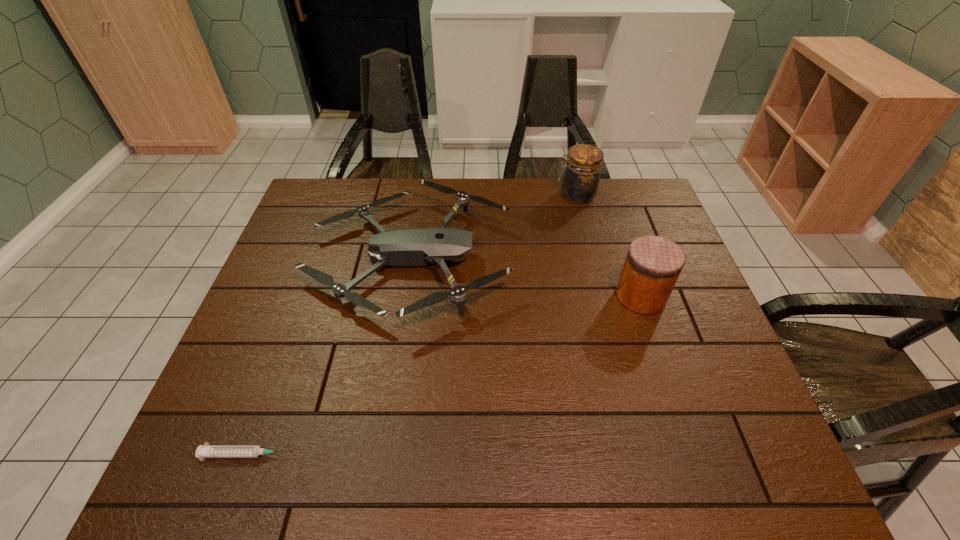
Where is `vacant position in the image that satisfies the following two spatial constraints: 1. on the lid of the farther jar; 2. on the back side of the nearer jar`? vacant position in the image that satisfies the following two spatial constraints: 1. on the lid of the farther jar; 2. on the back side of the nearer jar is located at coordinates (602, 296).

This screenshot has width=960, height=540. In order to click on free space that satisfies the following two spatial constraints: 1. with a camera mounted on the front of the drone; 2. on the left side of the nearer jar in this screenshot , I will do `click(403, 296)`.

Image resolution: width=960 pixels, height=540 pixels. Find the location of `vacant area in the image that satisfies the following two spatial constraints: 1. on the lid of the farther jar; 2. on the left side of the nearer jar`. vacant area in the image that satisfies the following two spatial constraints: 1. on the lid of the farther jar; 2. on the left side of the nearer jar is located at coordinates (602, 296).